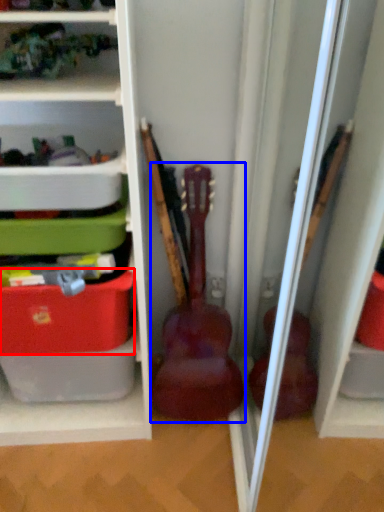
Question: Which object is closer to the camera taking this photo, storage box (highlighted by a red box) or guitar (highlighted by a blue box)?

Choices:
 (A) storage box
 (B) guitar

Answer: (A)